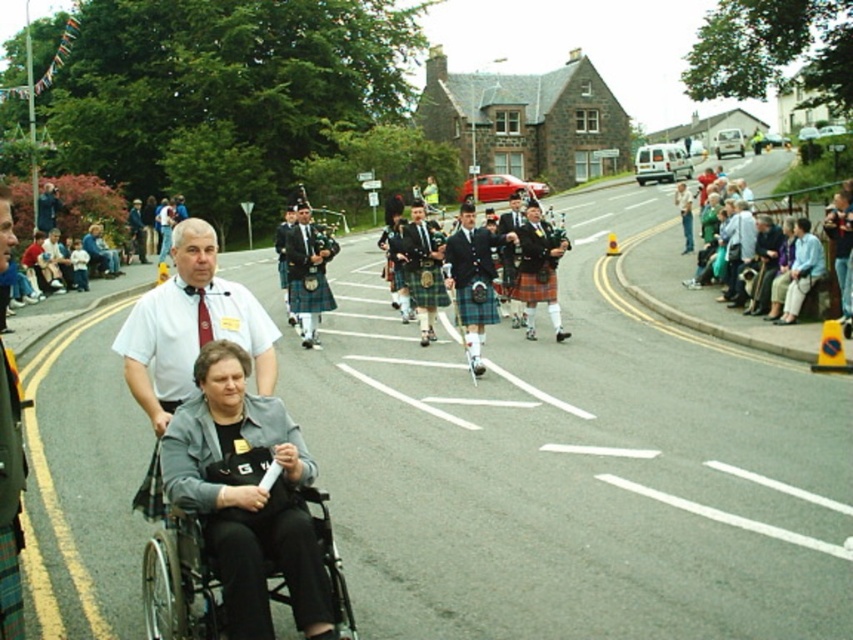
Is the position of white shirt at center more distant than that of green plaid kilt at center?

Yes, white shirt at center is behind green plaid kilt at center.

Can you confirm if white shirt at center is smaller than green plaid kilt at center?

Indeed, white shirt at center has a smaller size compared to green plaid kilt at center.

The width and height of the screenshot is (853, 640). Describe the element at coordinates (190, 326) in the screenshot. I see `white shirt at center` at that location.

The height and width of the screenshot is (640, 853). Identify the location of white shirt at center. (190, 326).

Can you confirm if black plastic wheelchair at lower left is wider than green plaid kilt at center?

Yes.

Which is in front, point (164, 620) or point (4, 572)?

Point (4, 572)

Who is more forward, (271, 592) or (9, 547)?

Positioned in front is point (9, 547).

Locate an element on the screen. black plastic wheelchair at lower left is located at coordinates (177, 568).

Does white shirt at center have a lesser height compared to black plastic wheelchair at lower left?

Correct, white shirt at center is not as tall as black plastic wheelchair at lower left.

Which is behind, point (274, 353) or point (331, 589)?

The point (274, 353) is more distant.

Where is `white shirt at center`? white shirt at center is located at coordinates (190, 326).